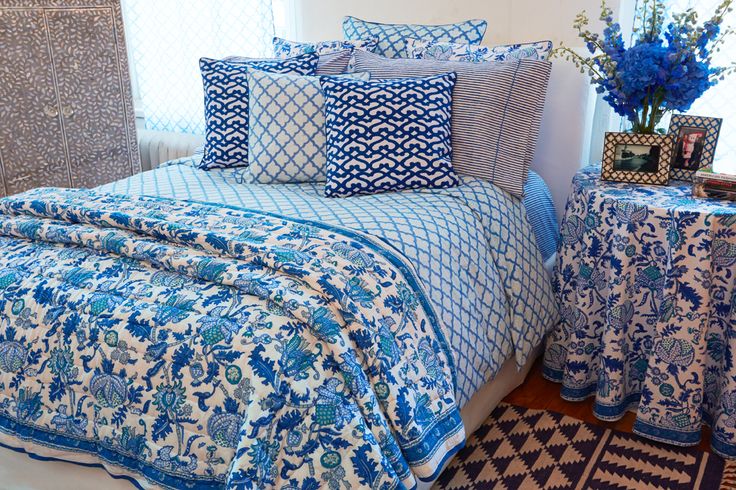
This screenshot has width=736, height=490. Identify the location of wooden floor. (550, 396).